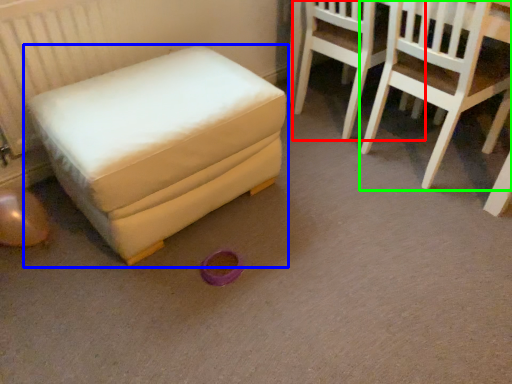
Question: Which is nearer to the chair (highlighted by a red box)? furniture (highlighted by a blue box) or chair (highlighted by a green box).

Choices:
 (A) furniture
 (B) chair

Answer: (B)